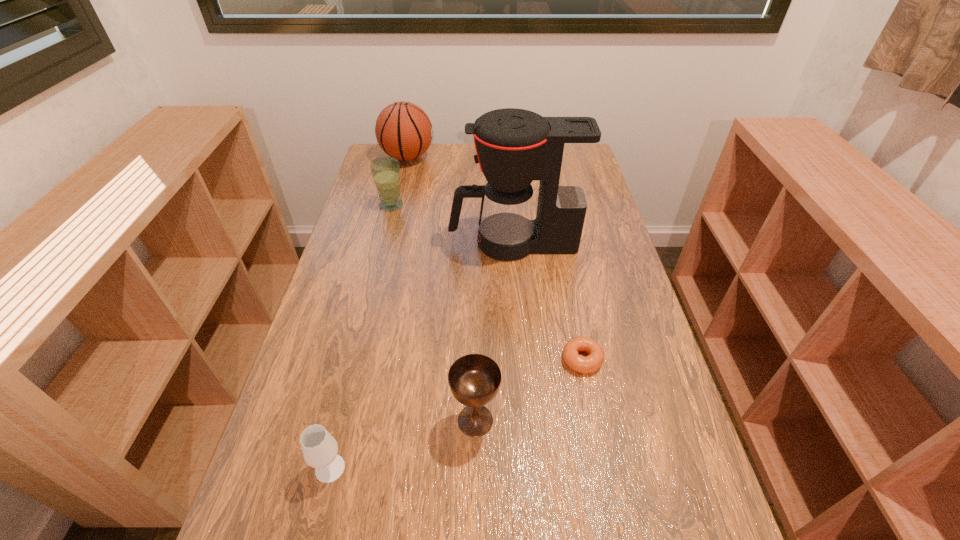
Identify the location of the shortest object. (591, 363).

Find the location of `free space located 0.110m pour from the carafe of the coffee maker`. free space located 0.110m pour from the carafe of the coffee maker is located at coordinates (413, 243).

Where is `vacant space situated pour from the carafe of the coffee maker`? vacant space situated pour from the carafe of the coffee maker is located at coordinates (417, 243).

The image size is (960, 540). I want to click on vacant space located pour from the carafe of the coffee maker, so click(400, 243).

The width and height of the screenshot is (960, 540). I want to click on vacant space located 0.060m on the side where the inflation valve is located, so click(450, 157).

You are a GUI agent. You are given a task and a screenshot of the screen. Output one action in this format:
    pyautogui.click(x=<x>, y=<y>)
    Task: Click on the vacant area located on the back of the fifth farthest object
    This screenshot has width=960, height=540.
    Given the screenshot: What is the action you would take?
    click(476, 361)

What are the coordinates of `vacant space situated on the right of the taller glass` in the screenshot? It's located at (470, 205).

Identify the location of free location located on the right of the nearer glass. This screenshot has height=540, width=960. (459, 468).

Identify the location of vacant space situated on the back of the doughnut. Image resolution: width=960 pixels, height=540 pixels. (564, 271).

What are the coordinates of `object that is at the far edge` in the screenshot? It's located at (403, 130).